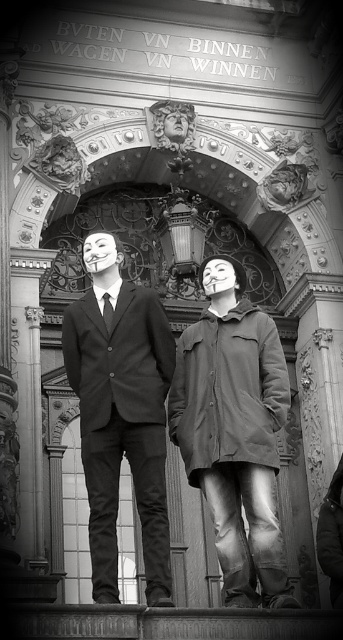
Question: Is matte black coat at center below matte black suit at center?

Choices:
 (A) yes
 (B) no

Answer: (A)

Question: Which object appears farthest from the camera in this image?

Choices:
 (A) matte black suit at center
 (B) matte black coat at center

Answer: (B)

Question: Is matte black coat at center bigger than matte black suit at center?

Choices:
 (A) no
 (B) yes

Answer: (A)

Question: Can you confirm if matte black coat at center is positioned to the right of matte black suit at center?

Choices:
 (A) no
 (B) yes

Answer: (B)